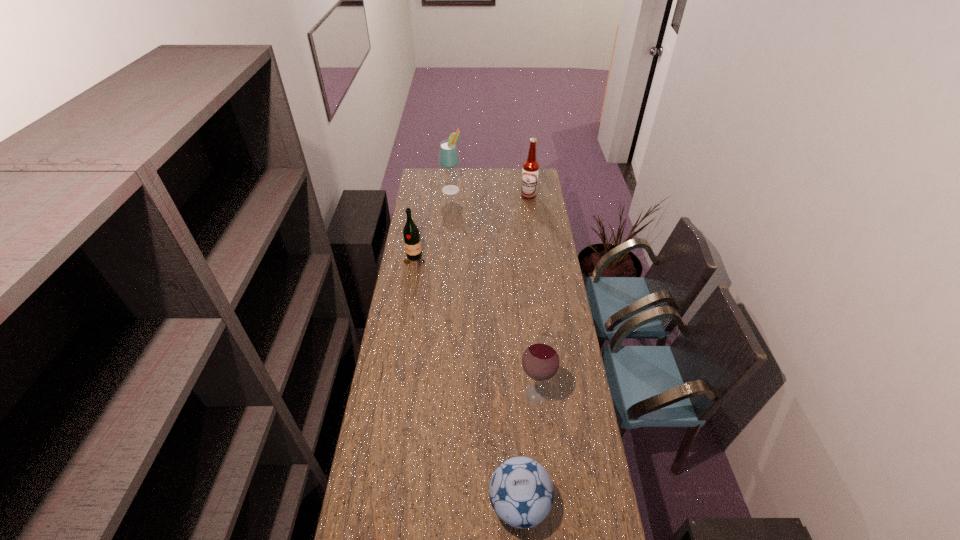
Locate an element on the screen. Image resolution: width=960 pixels, height=540 pixels. empty space that is in between the nearest alcohol and the shortest object is located at coordinates (527, 449).

Find the location of a particular element. free space between the fourth farthest object and the nearest object is located at coordinates (527, 449).

Locate an element on the screen. free spot between the nearest alcohol and the nearest object is located at coordinates (527, 449).

At what (x,y) coordinates should I click in order to perform the action: click on empty space that is in between the leftmost alcohol and the nearest alcohol. Please return your answer as a coordinate pair (x, y). Image resolution: width=960 pixels, height=540 pixels. Looking at the image, I should click on tap(493, 292).

I want to click on the fourth closest object to the fourth farthest object, so click(448, 158).

Locate an element on the screen. The height and width of the screenshot is (540, 960). the fourth closest object relative to the shortest object is located at coordinates (448, 158).

Select which alcohol is the second closest to the wine bottle. Please provide its 2D coordinates. Your answer should be formatted as a tuple, i.e. [(x, y)], where the tuple contains the x and y coordinates of a point satisfying the conditions above.

[(530, 172)]

Image resolution: width=960 pixels, height=540 pixels. Find the location of `alcohol that is the second closest to the soccer ball`. alcohol that is the second closest to the soccer ball is located at coordinates pyautogui.click(x=530, y=172).

Find the location of a particular element. The height and width of the screenshot is (540, 960). free region that satisfies the following two spatial constraints: 1. on the front side of the leftmost alcohol; 2. on the left side of the second nearest object is located at coordinates coord(434,394).